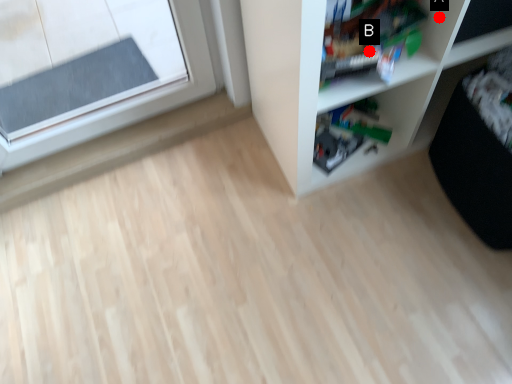
Question: Two points are circled on the image, labeled by A and B beside each circle. Which point is further to the camera?

Choices:
 (A) A is further
 (B) B is further

Answer: (B)